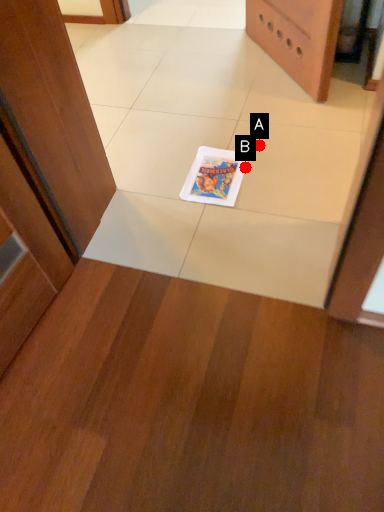
Question: Two points are circled on the image, labeled by A and B beside each circle. Which point is closer to the camera?

Choices:
 (A) A is closer
 (B) B is closer

Answer: (B)